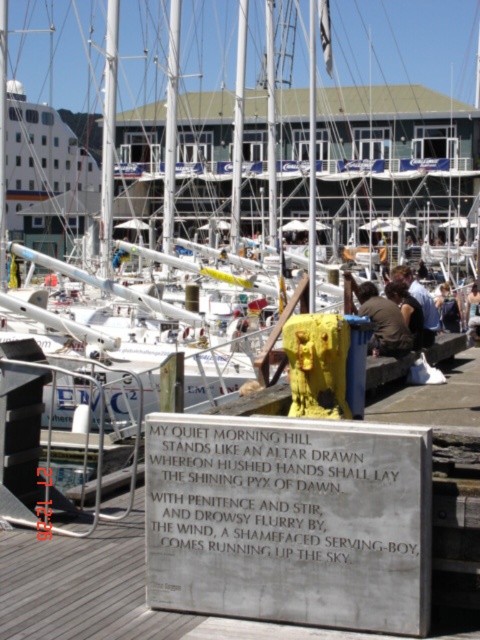
You are a photographer trying to capture a portrait of someone standing at the marina. You notice the light brown hair at center and the dark brown leather jacket at center. Which object should you focus on if you want to highlight something that takes up more space in the photo?

The light brown hair at center is larger in size than the dark brown leather jacket at center, so focusing on the light brown hair at center would highlight the object that takes up more space in the photo.

Looking at this image, what is located at the point with coordinates (x=383, y=321)?

At point (x=383, y=321) lies brown fabric at center.